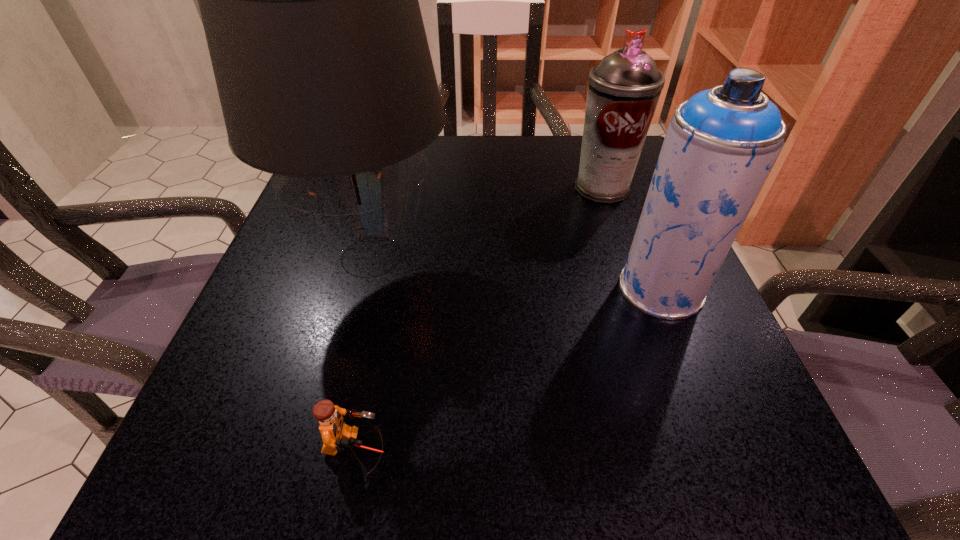
Where is `the tallest object`? This screenshot has width=960, height=540. the tallest object is located at coordinates (309, 1).

You are a GUI agent. You are given a task and a screenshot of the screen. Output one action in this format:
    pyautogui.click(x=<x>, y=<y>)
    Task: Click on the nearer aerosol can
    Image resolution: width=960 pixels, height=540 pixels.
    Given the screenshot: What is the action you would take?
    pyautogui.click(x=720, y=145)

Where is `the farthest object`? the farthest object is located at coordinates [624, 88].

In order to click on Lego in this screenshot , I will do `click(337, 436)`.

This screenshot has height=540, width=960. In order to click on the nearest object in this screenshot , I will do `click(337, 436)`.

Locate an element on the screen. This screenshot has height=540, width=960. free spot located 0.250m on the front of the lampshade is located at coordinates (313, 487).

You are a GUI agent. You are given a task and a screenshot of the screen. Output one action in this format:
    pyautogui.click(x=<x>, y=<y>)
    Task: Click on the free region located on the back of the nearer aerosol can
    This screenshot has height=540, width=960.
    Given the screenshot: What is the action you would take?
    (x=608, y=154)

I want to click on vacant space located 0.060m on the back of the farthest object, so click(591, 158).

Locate an element on the screen. The image size is (960, 540). free space located holding a crossbow in the hands of the nearest object is located at coordinates (469, 450).

Where is `object that is positioned at the far edge`? object that is positioned at the far edge is located at coordinates (624, 88).